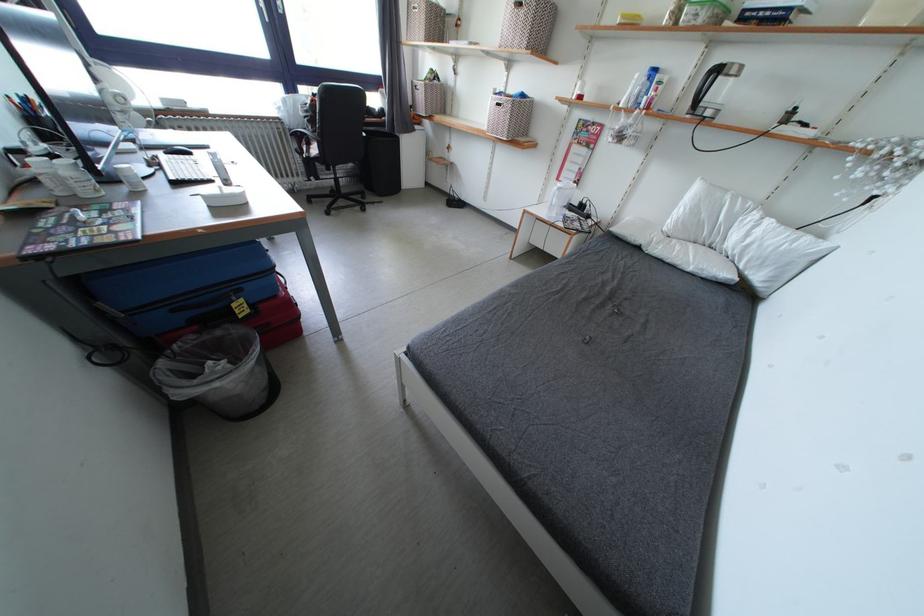
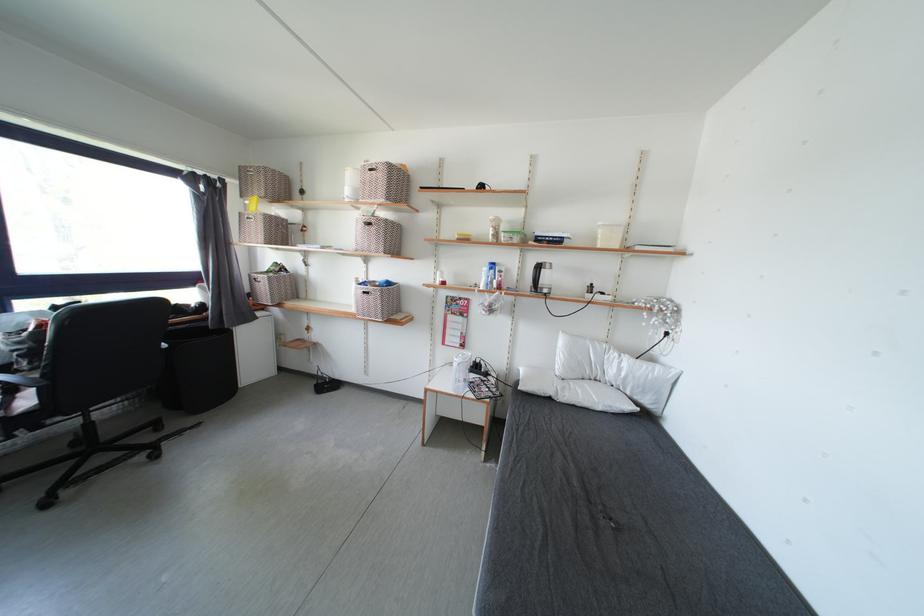
In the second image, find the point that corresponds to (x=443, y=82) in the first image.

(288, 274)